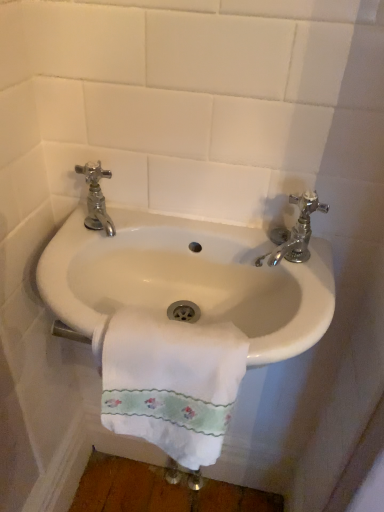
Where is `free space to the left of chrome/metallic faucet at right, the 2th tap positioned from the left`? The image size is (384, 512). free space to the left of chrome/metallic faucet at right, the 2th tap positioned from the left is located at coordinates (208, 236).